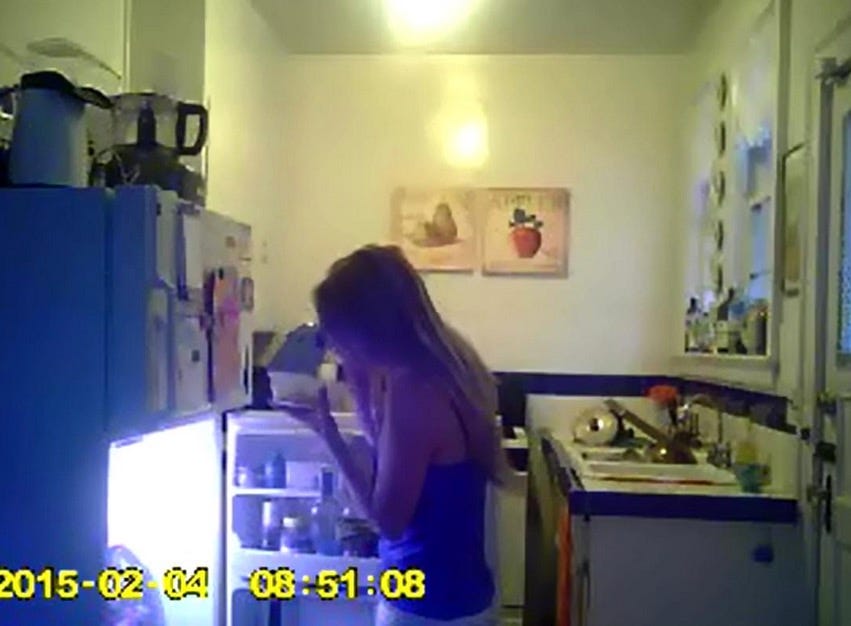
Identify the location of refrigerator door. (271, 423).